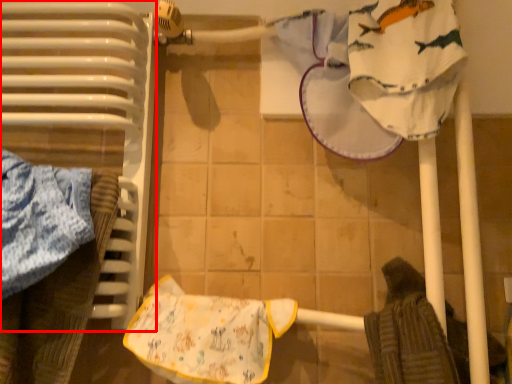
Question: From the image's perspective, what is the correct spatial positioning of radiator (annotated by the red box) in reference to material?

Choices:
 (A) below
 (B) above

Answer: (B)